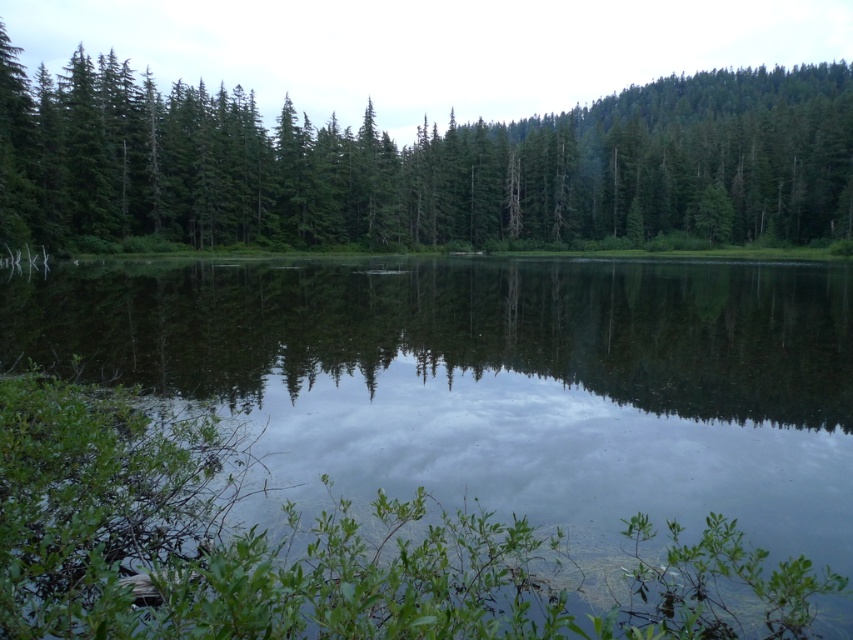
You are standing at the edge of the water in this serene landscape. There is a point marked at coordinates point [503,378]. What is the nature of the area at this specific point?

The point [503,378] indicates transparent water at center, so the area at this specific point is transparent water.

You are standing at the edge of the water in this serene landscape. You see the transparent water at center and the green matte trees at upper center. Which object is positioned higher in the scene?

The green matte trees at upper center are positioned higher in the scene than the transparent water at center, as they are located above it.

You are an artist planning to paint this landscape. You need to decide which area to focus on first based on their widths. Which object should you paint first, the transparent water at center or the green matte trees at upper center, if you start with the wider one?

The green matte trees at upper center should be painted first because they have a greater width than the transparent water at center according to the description.